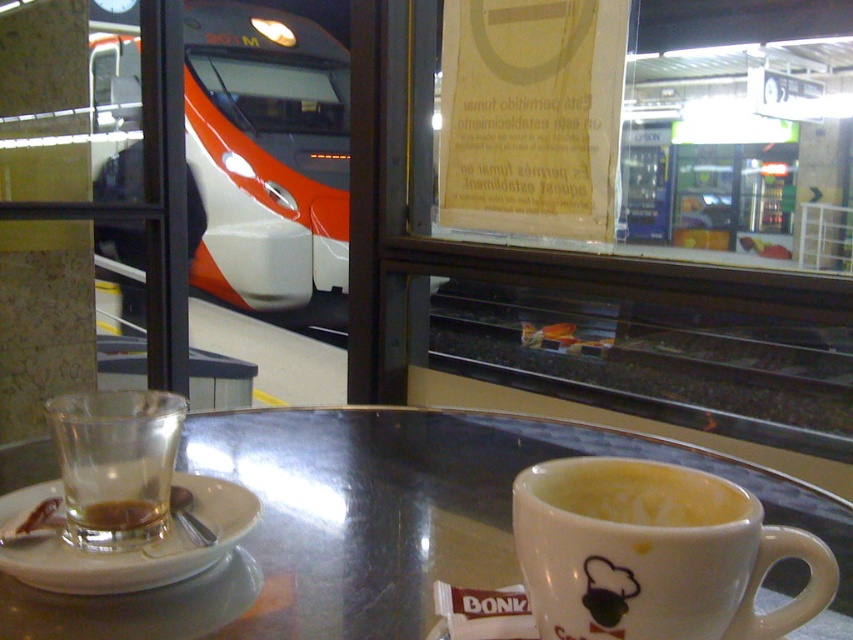
Question: In this image, where is white ceramic saucer at left located relative to translucent glass cup at lower left?

Choices:
 (A) left
 (B) right

Answer: (A)

Question: Which object is the farthest from the metallic reflective table at center?

Choices:
 (A) translucent glass at table left
 (B) yellow frothy coffee at center

Answer: (B)

Question: Observing the image, what is the correct spatial positioning of white glossy mug at lower center in reference to white ceramic saucer at left?

Choices:
 (A) left
 (B) right

Answer: (B)

Question: Which of these objects is positioned closest to the white glossy mug at lower center?

Choices:
 (A) white ceramic saucer at left
 (B) translucent glass cup at lower left

Answer: (A)

Question: Does metallic reflective table at center have a larger size compared to translucent glass at table left?

Choices:
 (A) no
 (B) yes

Answer: (B)

Question: Which of the following is the farthest from the observer?

Choices:
 (A) (648, 509)
 (B) (143, 406)
 (C) (589, 476)

Answer: (B)